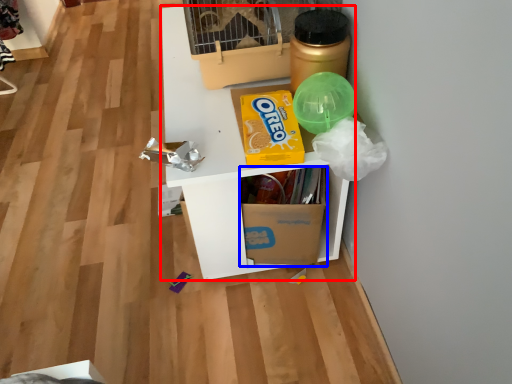
Question: Among these objects, which one is nearest to the camera, furniture (highlighted by a red box) or cardboard box (highlighted by a blue box)?

Choices:
 (A) furniture
 (B) cardboard box

Answer: (A)